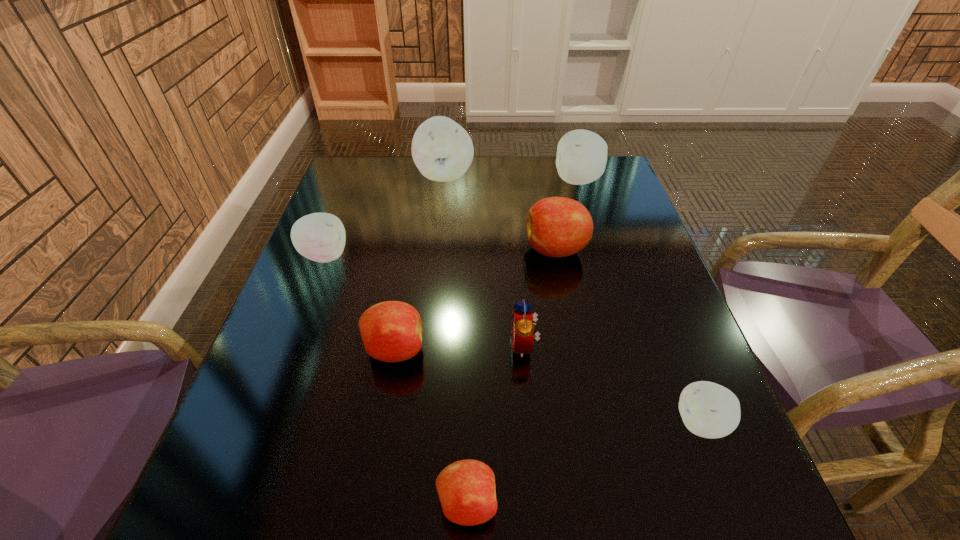
The width and height of the screenshot is (960, 540). In order to click on free space between the third farthest white apple and the red alarm clock in this screenshot , I will do `click(424, 300)`.

You are a GUI agent. You are given a task and a screenshot of the screen. Output one action in this format:
    pyautogui.click(x=<x>, y=<y>)
    Task: Click on the free space between the smallest white apple and the rightmost red apple
    This screenshot has height=540, width=960.
    Given the screenshot: What is the action you would take?
    point(629,336)

What are the coordinates of `the third closest object to the fifth farthest apple` in the screenshot? It's located at [x=466, y=488].

The image size is (960, 540). In order to click on object that is the seventh closest one to the smallest white apple in this screenshot , I will do `click(442, 150)`.

This screenshot has height=540, width=960. What are the coordinates of `the sixth closest apple to the nearest apple` in the screenshot? It's located at (581, 158).

Identify which apple is located as the second nearest to the nearest apple. Please provide its 2D coordinates. Your answer should be formatted as a tuple, i.e. [(x, y)], where the tuple contains the x and y coordinates of a point satisfying the conditions above.

[(709, 410)]

Locate an element on the screen. The image size is (960, 540). the third closest white apple relative to the second biggest white apple is located at coordinates (709, 410).

At what (x,y) coordinates should I click in order to perform the action: click on white apple that can be found as the second closest to the third smallest white apple. Please return your answer as a coordinate pair (x, y). The image size is (960, 540). Looking at the image, I should click on pyautogui.click(x=320, y=237).

Identify which red apple is the closest to the leftmost object. Please provide its 2D coordinates. Your answer should be formatted as a tuple, i.e. [(x, y)], where the tuple contains the x and y coordinates of a point satisfying the conditions above.

[(391, 331)]

Find the location of a particular element. The width and height of the screenshot is (960, 540). the second closest red apple to the leftmost apple is located at coordinates (557, 226).